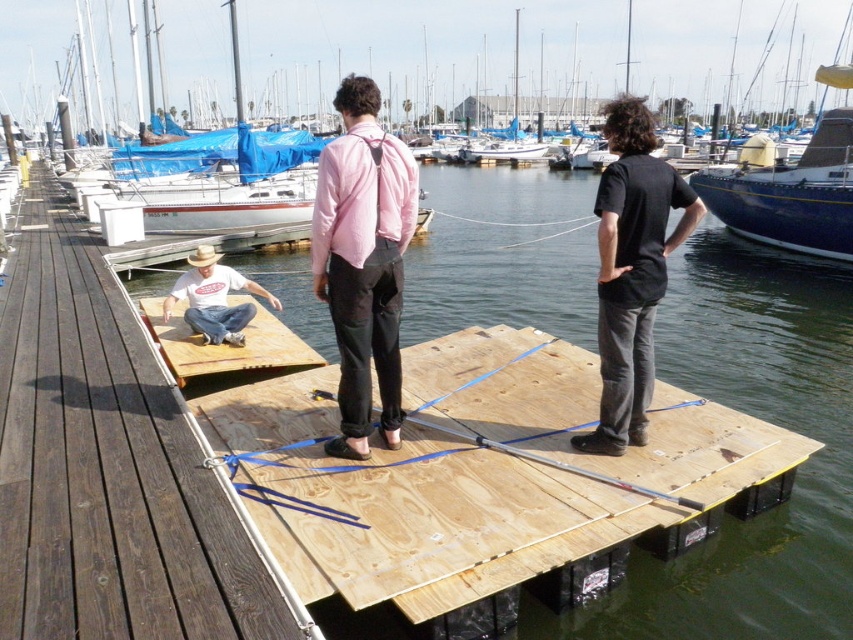
Which is behind, point (134, 468) or point (207, 314)?

The point (207, 314) is more distant.

Between brown wooden dock at left and matte white t-shirt at center, which one is positioned lower?

brown wooden dock at left is below.

Describe the element at coordinates (111, 467) in the screenshot. I see `brown wooden dock at left` at that location.

You are a GUI agent. You are given a task and a screenshot of the screen. Output one action in this format:
    pyautogui.click(x=<x>, y=<y>)
    Task: Click on the brown wooden dock at left
    
    Given the screenshot: What is the action you would take?
    pyautogui.click(x=111, y=467)

Is matte pink shirt at center to the right of wooden ramp at center from the viewer's perspective?

Indeed, matte pink shirt at center is positioned on the right side of wooden ramp at center.

The image size is (853, 640). What are the coordinates of `matte pink shirt at center` in the screenshot? It's located at point(631,269).

Consider the image. Who is shorter, black cotton shirt at center or blue glossy boat at upper right?

With less height is black cotton shirt at center.

I want to click on black cotton shirt at center, so click(631, 269).

Where is `black cotton shirt at center`? black cotton shirt at center is located at coordinates (631, 269).